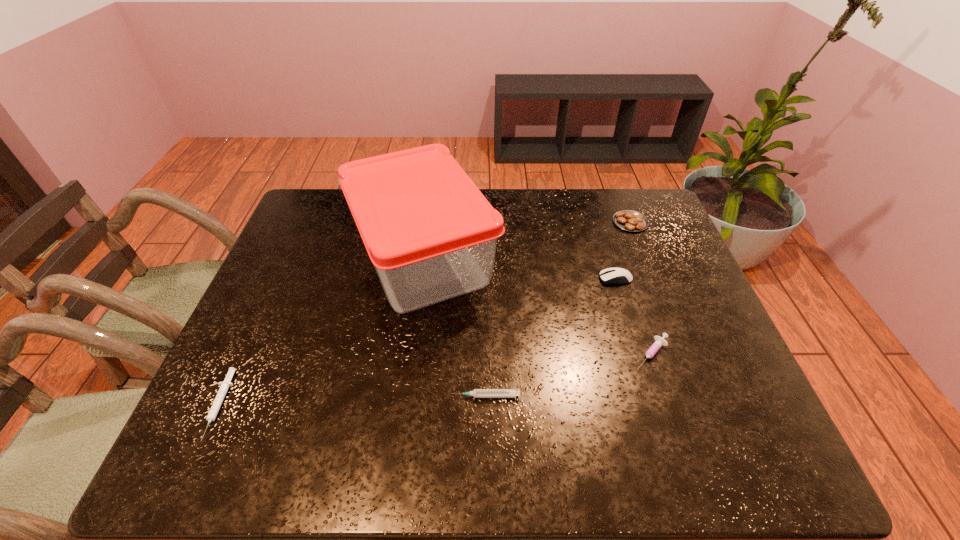
You are a GUI agent. You are given a task and a screenshot of the screen. Output one action in this format:
    pyautogui.click(x=<x>, y=<y>)
    Task: Click on the free space located on the back of the rightmost syringe
    The height and width of the screenshot is (540, 960).
    Given the screenshot: What is the action you would take?
    point(631,292)

Locate an element on the screen. vacant space located at the needle end of the second syringe from right to left is located at coordinates (366, 396).

I want to click on vacant space located at the needle end of the second syringe from right to left, so click(x=406, y=396).

At what (x,y) coordinates should I click in order to perform the action: click on vacant space located 0.250m at the needle end of the second syringe from right to left. Please return your answer as a coordinate pair (x, y). Looking at the image, I should click on (338, 396).

You are a GUI agent. You are given a task and a screenshot of the screen. Output one action in this format:
    pyautogui.click(x=<x>, y=<y>)
    Task: Click on the vacant space situated on the right of the shortest syringe
    
    Given the screenshot: What is the action you would take?
    pyautogui.click(x=369, y=405)

The height and width of the screenshot is (540, 960). Identify the location of tray present at the far edge. (431, 235).

Locate an element on the screen. pastry situated at the far edge is located at coordinates (628, 220).

The width and height of the screenshot is (960, 540). Find the location of `object situated at the near edge`. object situated at the near edge is located at coordinates (224, 386).

Image resolution: width=960 pixels, height=540 pixels. Identify the location of object situated at the left edge. (224, 386).

Image resolution: width=960 pixels, height=540 pixels. What are the coordinates of `pastry that is at the right edge` in the screenshot? It's located at (628, 220).